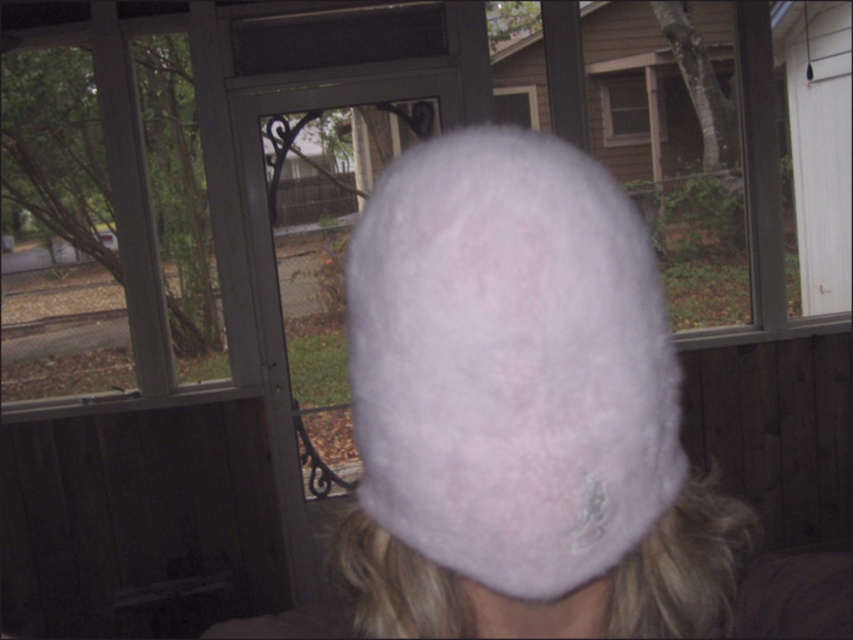
You are a delivery person trying to see through the clear glass screen door at center to check the address. However, the fuzzy pink hat at center is blocking your view. Can you lift the hat to see through the door?

The fuzzy pink hat at center is positioned over the clear glass screen door at center, so lifting the hat would allow you to see through the door.

You are standing in a room and want to touch the clear glass screen door at center. The fuzzy pink hat at center is in your way. Can you move around it to reach the door?

The fuzzy pink hat at center is closer to the viewer than the clear glass screen door at center, so you can move around it to reach the clear glass screen door at center since it is behind the hat.

You are a photographer trying to capture the fuzzy pink hat at center in the center of your photo. Based on its current position at point 0.567, 0.599, do you need to adjust your camera to the left or right to center it?

The fuzzy pink hat at center is already positioned at point (509,362), which is close to the center of the image. However, since the exact center would be at point (426,320), you might need to adjust slightly to the left and up to perfectly center it.